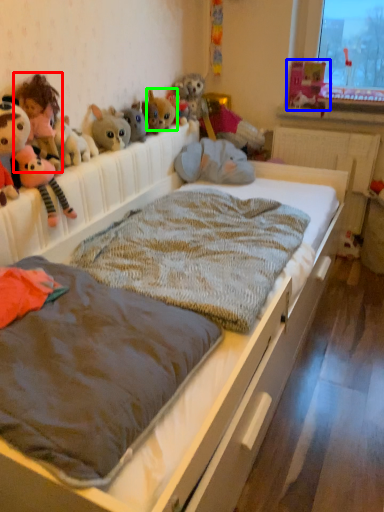
Question: Which is farther away from child (highlighted by a red box)? toy (highlighted by a blue box) or toy (highlighted by a green box)?

Choices:
 (A) toy
 (B) toy

Answer: (A)